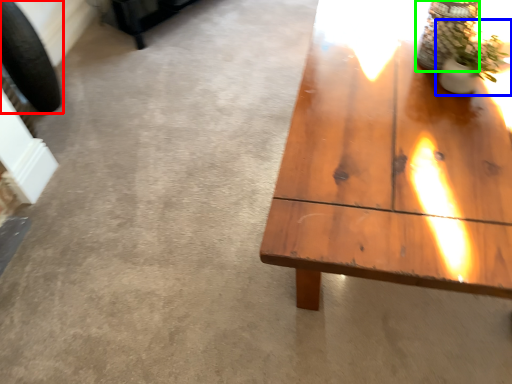
Question: Considering the real-world distances, which object is farthest from car tire (highlighted by a red box)? houseplant (highlighted by a blue box) or glass vase (highlighted by a green box)?

Choices:
 (A) houseplant
 (B) glass vase

Answer: (A)